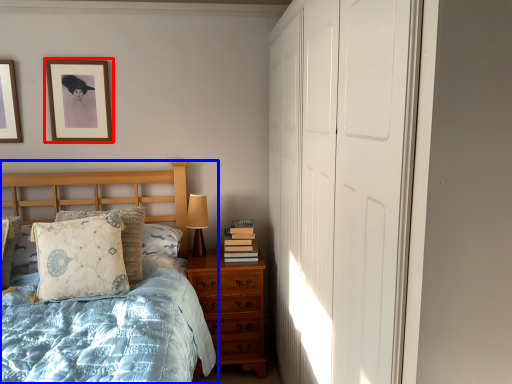
Question: Which object appears closest to the camera in this image, picture frame (highlighted by a red box) or bed (highlighted by a blue box)?

Choices:
 (A) picture frame
 (B) bed

Answer: (B)